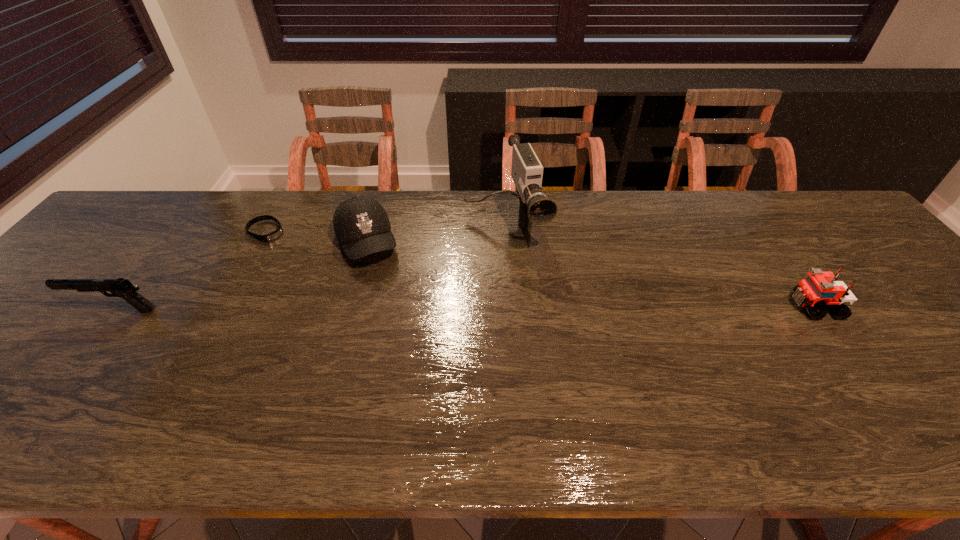
Where is `vacant position located 0.270m on the display of the shortest object`? This screenshot has height=540, width=960. vacant position located 0.270m on the display of the shortest object is located at coordinates (337, 280).

The height and width of the screenshot is (540, 960). I want to click on baseball cap at the far edge, so click(x=361, y=224).

You are a GUI agent. You are given a task and a screenshot of the screen. Output one action in this format:
    pyautogui.click(x=<x>, y=<y>)
    Task: Click on the camcorder at the far edge
    
    Given the screenshot: What is the action you would take?
    pyautogui.click(x=535, y=208)

The image size is (960, 540). Find the location of `wristband located at the far edge`. wristband located at the far edge is located at coordinates click(278, 232).

Where is `object that is positioned at the left edge`? Image resolution: width=960 pixels, height=540 pixels. object that is positioned at the left edge is located at coordinates pyautogui.click(x=123, y=288).

Identify the location of vacant space at the far edge of the desktop. This screenshot has height=540, width=960. (745, 238).

The height and width of the screenshot is (540, 960). I want to click on vacant space at the left edge, so click(104, 256).

The width and height of the screenshot is (960, 540). In order to click on vacant space in between the fourth object from left to right and the leftmost object in this screenshot , I will do `click(310, 268)`.

Locate an element on the screen. vacant space in between the leftmost object and the camcorder is located at coordinates (310, 268).

Identify the location of vacant region between the Lego and the fourth object from left to right. (660, 266).